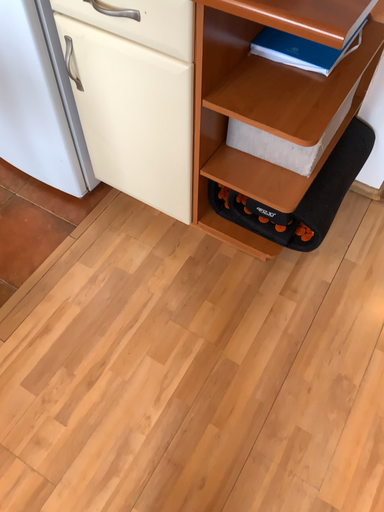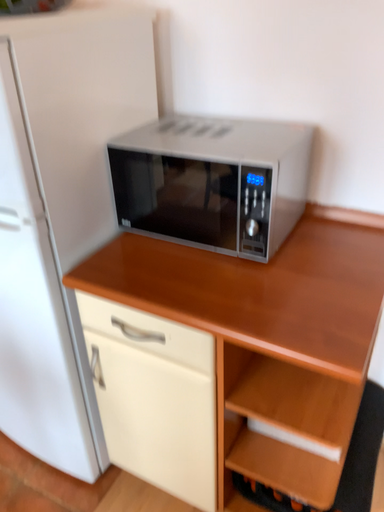
Question: Which way did the camera rotate in the video?

Choices:
 (A) rotated downward
 (B) rotated upward

Answer: (B)